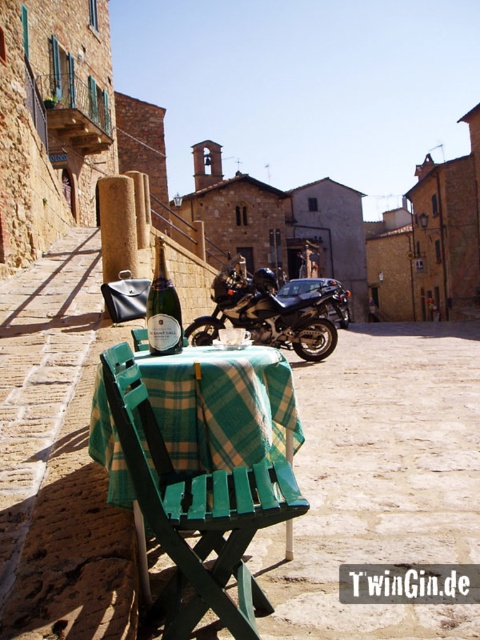
Question: Does green plastic chair at center have a lesser width compared to matte glass champagne bottle at center?

Choices:
 (A) yes
 (B) no

Answer: (B)

Question: Based on their relative distances, which object is farther from the matte glass champagne bottle at center?

Choices:
 (A) green plastic chair at center
 (B) green plaid tablecloth at center
 (C) shiny black motorcycle at center

Answer: (B)

Question: Is green plaid tablecloth at center to the right of green plastic chair at center from the viewer's perspective?

Choices:
 (A) no
 (B) yes

Answer: (B)

Question: Among these objects, which one is nearest to the camera?

Choices:
 (A) shiny black motorcycle at center
 (B) green plastic chair at center
 (C) green plaid tablecloth at center

Answer: (B)

Question: Which object is positioned closest to the matte glass champagne bottle at center?

Choices:
 (A) green plastic chair at center
 (B) shiny black motorcycle at center
 (C) green plaid tablecloth at center

Answer: (A)

Question: Does green plaid tablecloth at center have a larger size compared to green plastic chair at center?

Choices:
 (A) no
 (B) yes

Answer: (B)